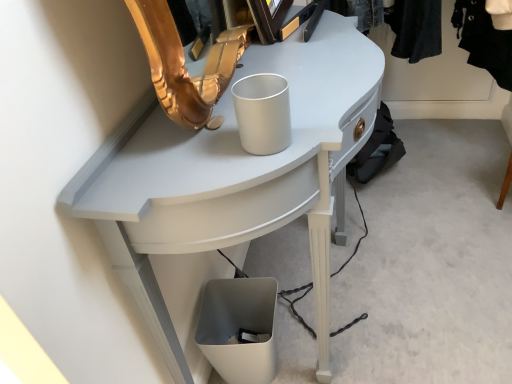
Describe the element at coordinates (232, 174) in the screenshot. I see `white glossy desk at center` at that location.

Where is `white glossy desk at center`? white glossy desk at center is located at coordinates (232, 174).

This screenshot has height=384, width=512. Find the location of `white glossy desk at center`. white glossy desk at center is located at coordinates (232, 174).